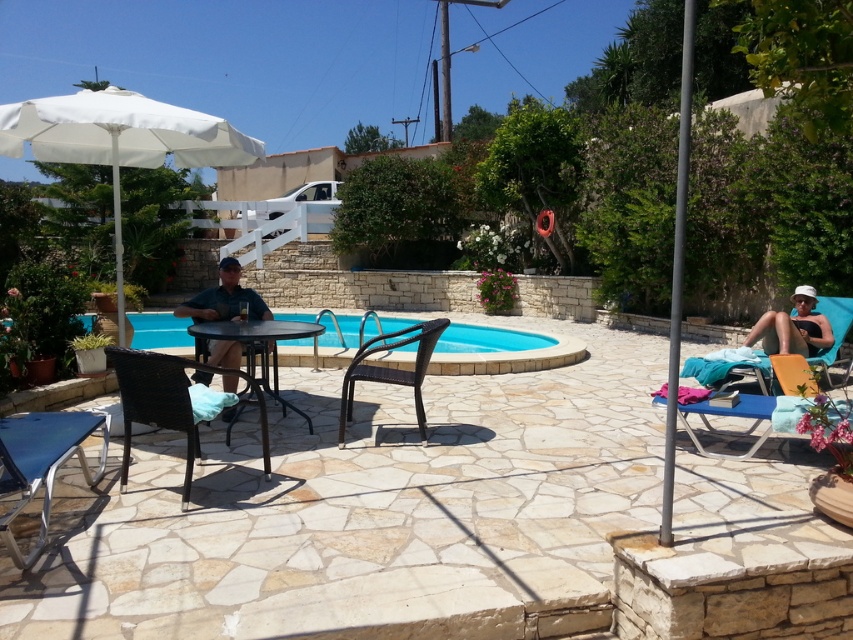
Can you confirm if matte black shirt at center is wider than beige fabric towel at lower right?

No, matte black shirt at center is not wider than beige fabric towel at lower right.

What do you see at coordinates (224, 298) in the screenshot? This screenshot has width=853, height=640. I see `matte black shirt at center` at bounding box center [224, 298].

At what (x,y) coordinates should I click in order to perform the action: click on matte black shirt at center. Please return your answer as a coordinate pair (x, y). The width and height of the screenshot is (853, 640). Looking at the image, I should click on (224, 298).

Who is more forward, (364, 356) or (207, 324)?

Positioned in front is point (364, 356).

Can you confirm if brown woven chair at center is positioned to the right of metallic wicker table at center?

Correct, you'll find brown woven chair at center to the right of metallic wicker table at center.

Does point (421, 412) come behind point (225, 438)?

Yes, point (421, 412) is behind point (225, 438).

This screenshot has height=640, width=853. In order to click on brown woven chair at center in this screenshot , I will do `click(392, 369)`.

In the scene shown: Who is positioned more to the left, white fabric umbrella at upper left or woven brown chair at lower left?

From the viewer's perspective, white fabric umbrella at upper left appears more on the left side.

Who is taller, white fabric umbrella at upper left or woven brown chair at lower left?

white fabric umbrella at upper left

Who is more distant from viewer, (141, 129) or (155, 364)?

Positioned behind is point (141, 129).

The image size is (853, 640). What are the coordinates of `white fabric umbrella at upper left` in the screenshot? It's located at (120, 140).